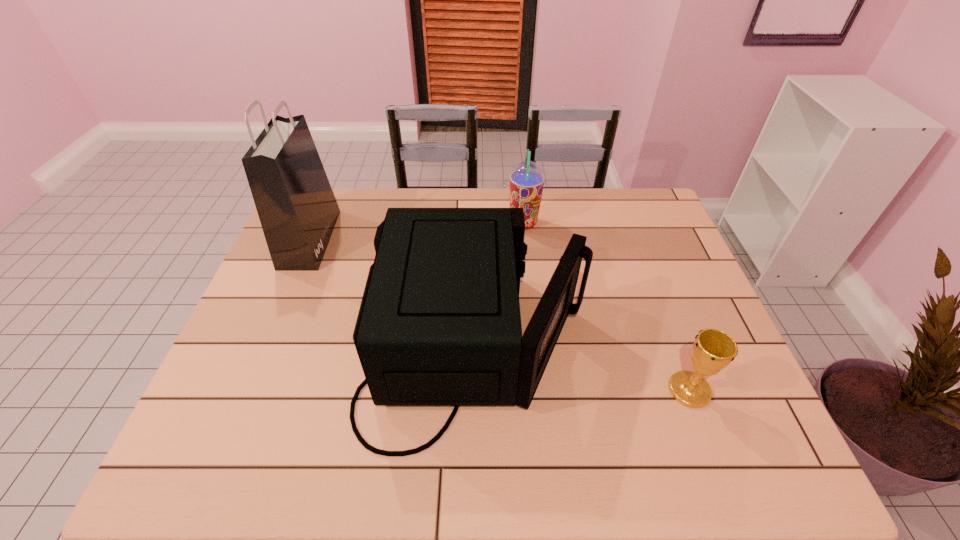
Where is `vacant region that satisfies the following two spatial constraints: 1. on the front with handles of the shopping bag; 2. on the back side of the chalice`? This screenshot has height=540, width=960. vacant region that satisfies the following two spatial constraints: 1. on the front with handles of the shopping bag; 2. on the back side of the chalice is located at coordinates (247, 390).

I want to click on vacant region that satisfies the following two spatial constraints: 1. on the front side of the smoothie; 2. with the door open on the microwave oven, so click(538, 347).

What are the coordinates of `free spot that satisfies the following two spatial constraints: 1. on the front with handles of the leftmost object; 2. on the back side of the rightmost object` in the screenshot? It's located at (247, 390).